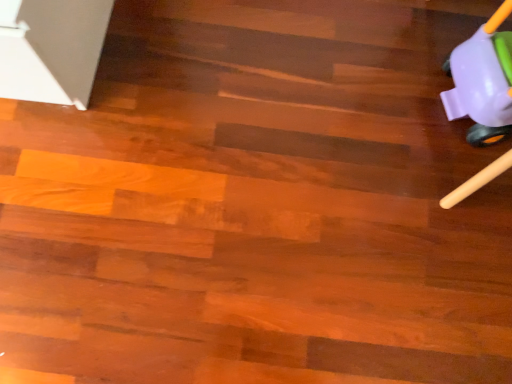
This screenshot has height=384, width=512. In order to click on vacant location below purple plastic toy at upper right (from a real-world perspective) in this screenshot , I will do `click(450, 116)`.